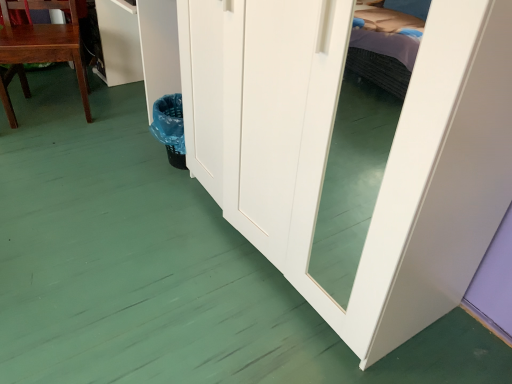
Question: Is white glossy cabinet at upper left further to camera compared to matte wood chair at left?

Choices:
 (A) yes
 (B) no

Answer: (A)

Question: From a real-world perspective, is white glossy cabinet at upper left over matte wood chair at left?

Choices:
 (A) yes
 (B) no

Answer: (B)

Question: Does white glossy cabinet at upper left come in front of matte wood chair at left?

Choices:
 (A) yes
 (B) no

Answer: (B)

Question: Considering the relative sizes of white glossy cabinet at upper left and matte wood chair at left in the image provided, is white glossy cabinet at upper left thinner than matte wood chair at left?

Choices:
 (A) no
 (B) yes

Answer: (B)

Question: Considering the relative sizes of white glossy cabinet at upper left and matte wood chair at left in the image provided, is white glossy cabinet at upper left shorter than matte wood chair at left?

Choices:
 (A) yes
 (B) no

Answer: (A)

Question: Are white glossy cabinet at upper left and matte wood chair at left located far from each other?

Choices:
 (A) yes
 (B) no

Answer: (B)

Question: Are matte wood chair at left and white glossy cabinet at upper left located far from each other?

Choices:
 (A) no
 (B) yes

Answer: (A)

Question: Is matte wood chair at left bigger than white glossy cabinet at upper left?

Choices:
 (A) no
 (B) yes

Answer: (B)

Question: Is matte wood chair at left closer to the viewer compared to white glossy cabinet at upper left?

Choices:
 (A) no
 (B) yes

Answer: (B)

Question: Would you say matte wood chair at left is outside white glossy cabinet at upper left?

Choices:
 (A) yes
 (B) no

Answer: (A)

Question: Is matte wood chair at left at the right side of white glossy cabinet at upper left?

Choices:
 (A) yes
 (B) no

Answer: (B)

Question: Is matte wood chair at left facing away from white glossy cabinet at upper left?

Choices:
 (A) no
 (B) yes

Answer: (A)

Question: From the image's perspective, is matte wood chair at left positioned above or below white glossy cabinet at upper left?

Choices:
 (A) above
 (B) below

Answer: (B)